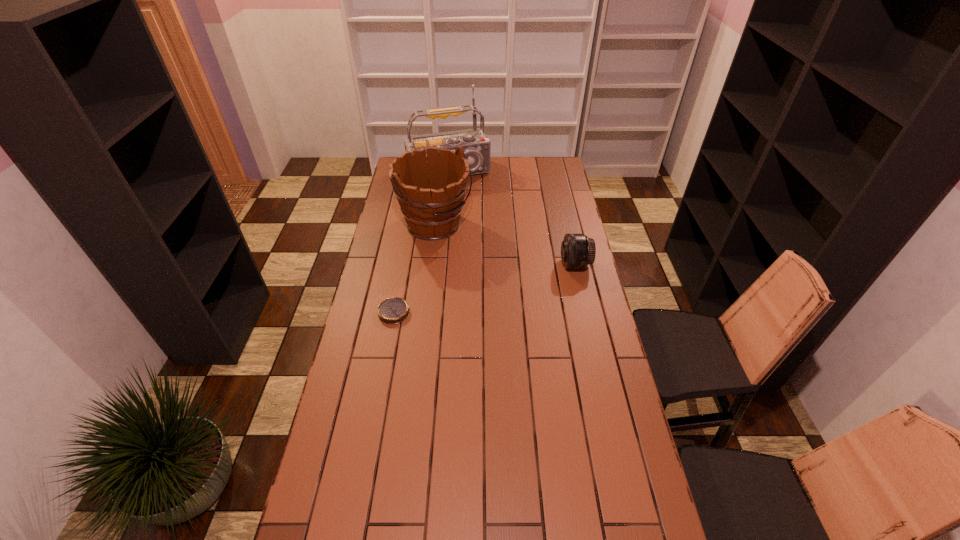
In order to click on free space on the desktop that is between the nearest object and the third tallest object and is positioned with the handle on the third nearest object in this screenshot , I will do `click(506, 282)`.

Find the location of a particular element. Image resolution: width=960 pixels, height=540 pixels. free spot on the desktop that is between the nearest object and the second nearest object and is positioned on the front-facing side of the tallest object is located at coordinates (494, 286).